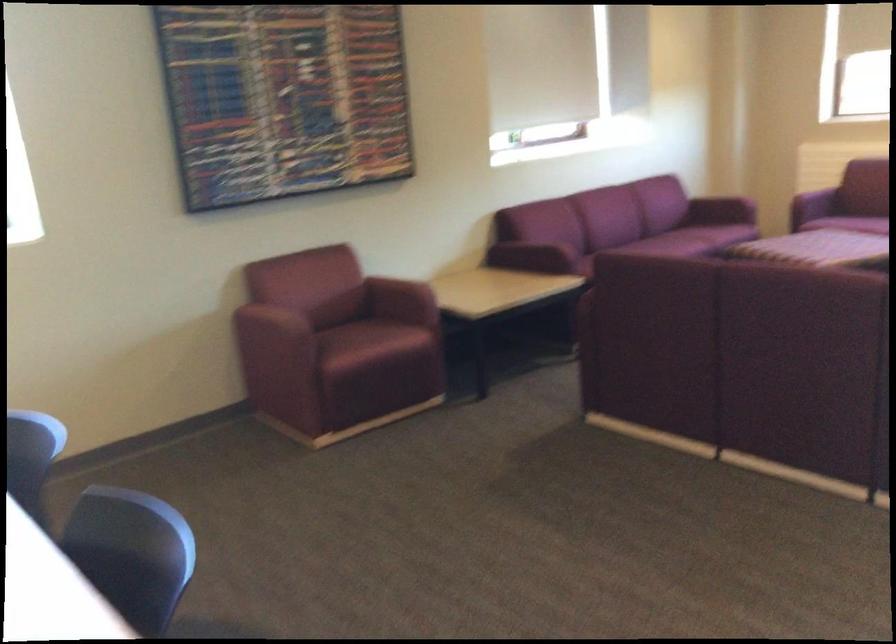
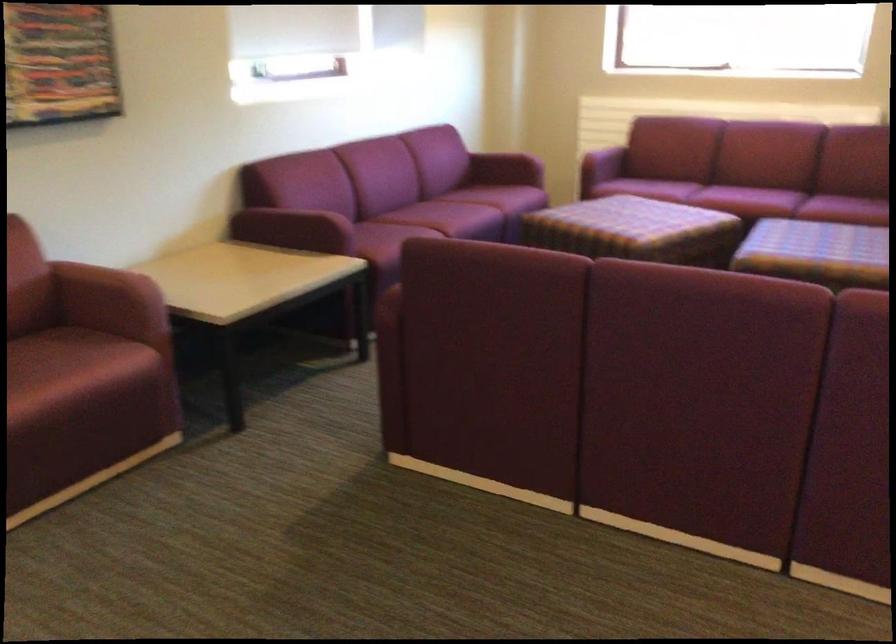
Question: What movement of the cameraman would produce the second image?

Choices:
 (A) Left
 (B) Right
 (C) Forward
 (D) Backward

Answer: (C)